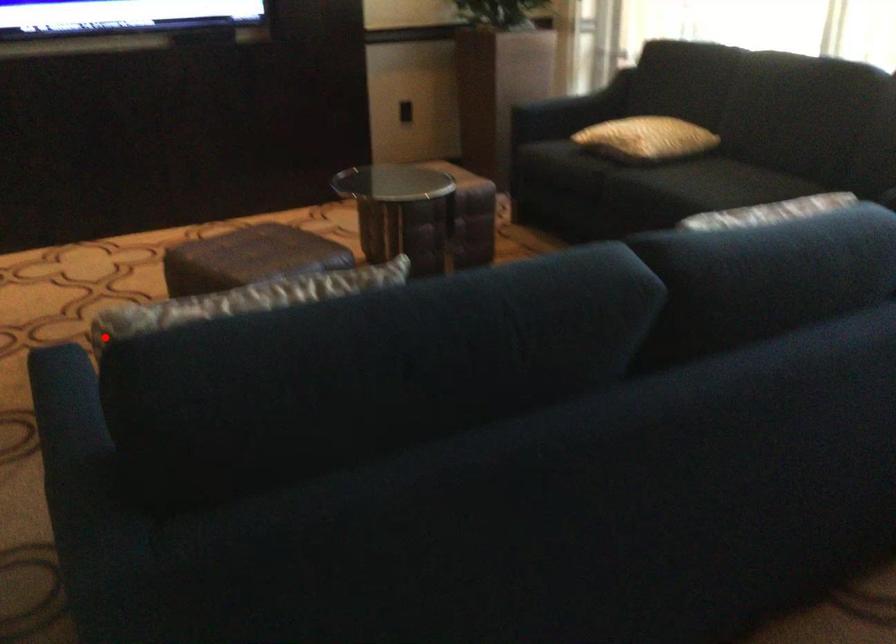
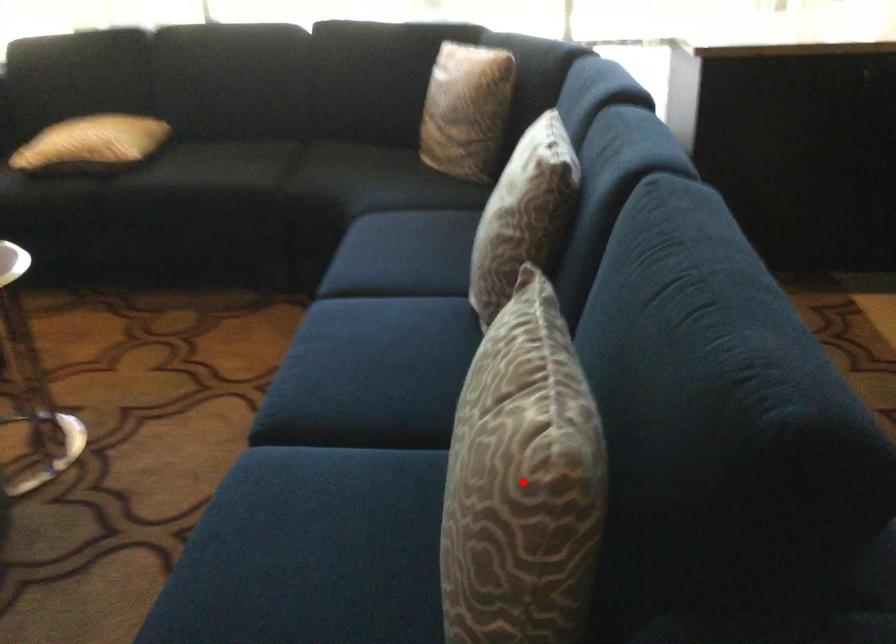
I am providing you with two images of the same scene from different viewpoints. A red point is marked on the first image and another point is marked on the second image. Is the red point in image1 aligned with the point shown in image2?

Yes